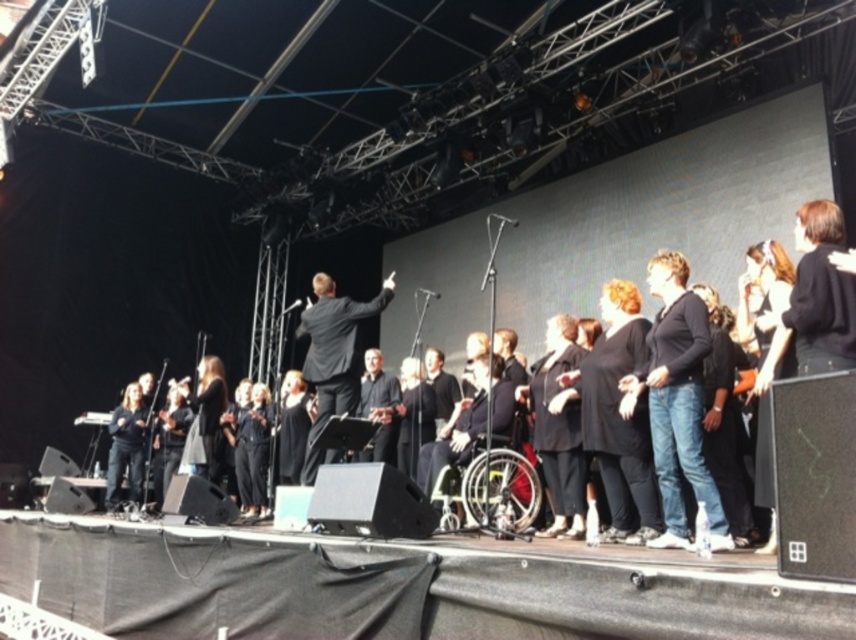
Does black matte suit at center have a lesser width compared to black suit at center?

Yes.

Which is more to the right, black matte suit at center or black suit at center?

From the viewer's perspective, black matte suit at center appears more on the right side.

Who is more forward, [640,378] or [331,374]?

Point [640,378] is in front.

Locate an element on the screen. Image resolution: width=856 pixels, height=640 pixels. black matte suit at center is located at coordinates (812, 301).